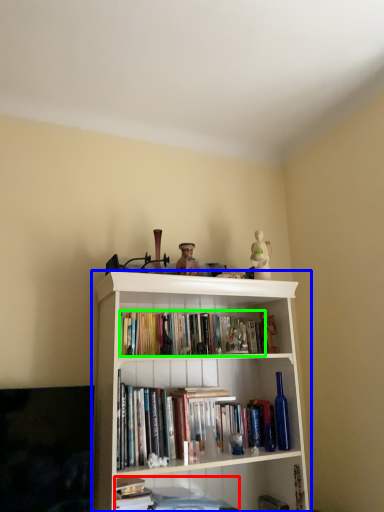
Question: Which object is positioned closest to book (highlighted by a red box)? Select from bookcase (highlighted by a blue box) and book (highlighted by a green box).

Choices:
 (A) bookcase
 (B) book

Answer: (A)